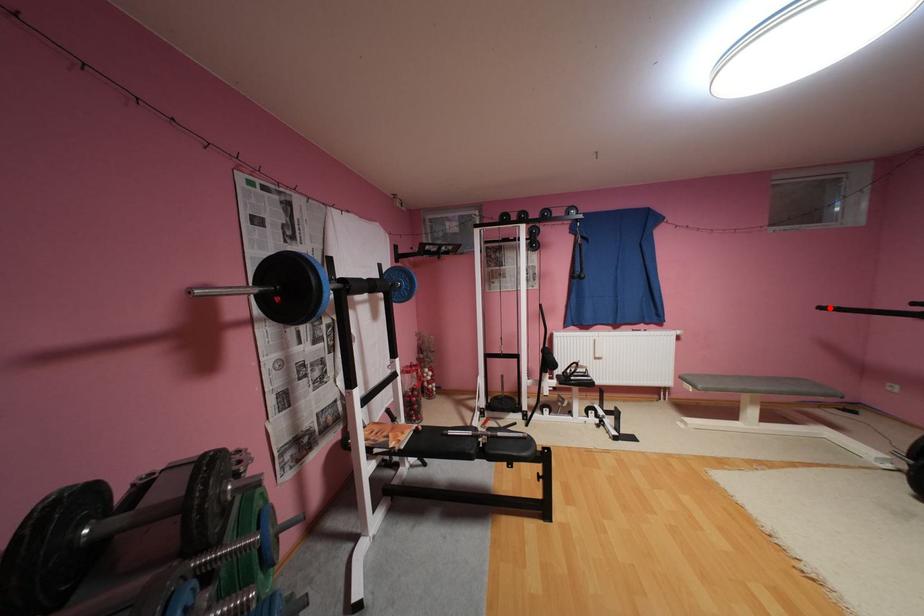
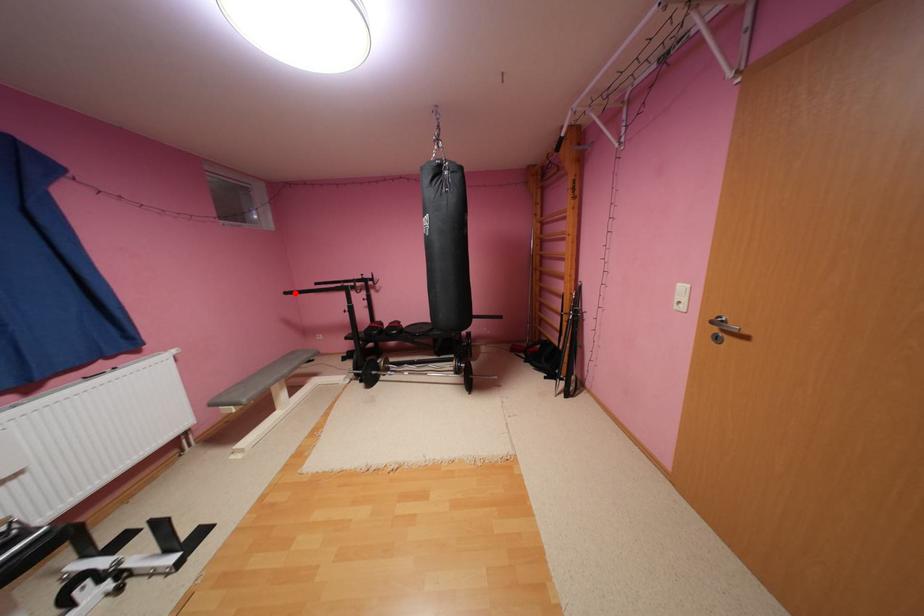
I am providing you with two images of the same scene from different viewpoints. A red point is marked on the first image and another point is marked on the second image. Are the points marked in image1 and image2 representing the same 3D position?

Yes